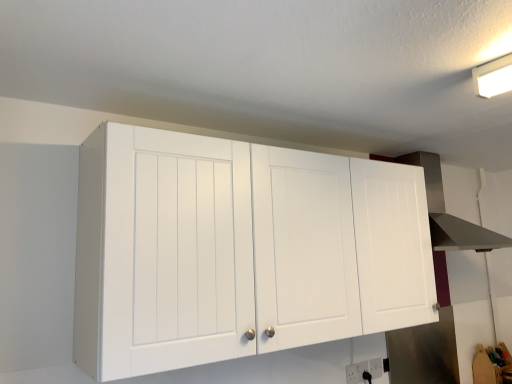
Question: Is stainless steel vent at upper right thinner than white plastic electric outlet at lower center, which ranks as the 1th electric outlet in left-to-right order?

Choices:
 (A) no
 (B) yes

Answer: (A)

Question: From a real-world perspective, is stainless steel vent at upper right on white plastic electric outlet at lower center, positioned as the 2th electric outlet in right-to-left order?

Choices:
 (A) no
 (B) yes

Answer: (B)

Question: Is stainless steel vent at upper right bigger than white plastic electric outlet at lower center, which ranks as the 1th electric outlet in left-to-right order?

Choices:
 (A) no
 (B) yes

Answer: (B)

Question: Are stainless steel vent at upper right and white plastic electric outlet at lower center, positioned as the 2th electric outlet in right-to-left order, far apart?

Choices:
 (A) no
 (B) yes

Answer: (B)

Question: Can you confirm if stainless steel vent at upper right is wider than white plastic electric outlet at lower center, positioned as the 2th electric outlet in right-to-left order?

Choices:
 (A) no
 (B) yes

Answer: (B)

Question: Is stainless steel vent at upper right in contact with white plastic electric outlet at lower center, arranged as the 2th electric outlet when viewed from the back?

Choices:
 (A) no
 (B) yes

Answer: (A)

Question: Is white plastic electric outlet at lower center, the first electric outlet viewed from the front, surrounding white matte cabinet at upper center?

Choices:
 (A) no
 (B) yes

Answer: (A)

Question: From a real-world perspective, is white plastic electric outlet at lower center, which ranks as the 1th electric outlet in left-to-right order, over white matte cabinet at upper center?

Choices:
 (A) yes
 (B) no

Answer: (B)

Question: Does white plastic electric outlet at lower center, positioned as the 2th electric outlet in right-to-left order, have a greater width compared to white matte cabinet at upper center?

Choices:
 (A) no
 (B) yes

Answer: (A)

Question: From the image's perspective, would you say white plastic electric outlet at lower center, the first electric outlet viewed from the front, is positioned over white matte cabinet at upper center?

Choices:
 (A) yes
 (B) no

Answer: (B)

Question: Considering the relative positions of white plastic electric outlet at lower center, which ranks as the 1th electric outlet in left-to-right order, and white matte cabinet at upper center in the image provided, is white plastic electric outlet at lower center, which ranks as the 1th electric outlet in left-to-right order, to the right of white matte cabinet at upper center from the viewer's perspective?

Choices:
 (A) no
 (B) yes

Answer: (B)

Question: From the image's perspective, is white plastic electric outlet at lower center, which ranks as the 1th electric outlet in left-to-right order, below white matte cabinet at upper center?

Choices:
 (A) yes
 (B) no

Answer: (A)

Question: Is white plastic electric outlet at lower center, arranged as the 2th electric outlet when viewed from the back, a part of white matte cabinet at upper center?

Choices:
 (A) no
 (B) yes

Answer: (A)